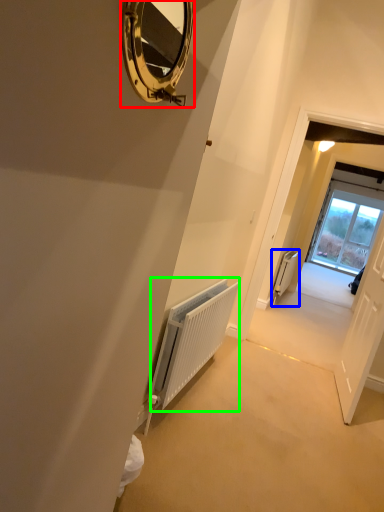
Question: Which object is the farthest from mirror (highlighted by a red box)? Choose among these: radiator (highlighted by a blue box) or radiator (highlighted by a green box).

Choices:
 (A) radiator
 (B) radiator

Answer: (A)